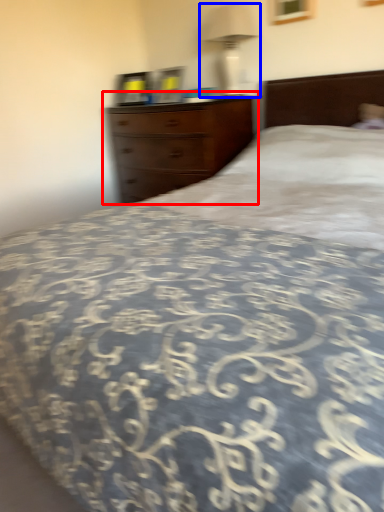
Question: Which object appears farthest to the camera in this image, chest of drawers (highlighted by a red box) or bedside lamp (highlighted by a blue box)?

Choices:
 (A) chest of drawers
 (B) bedside lamp

Answer: (B)